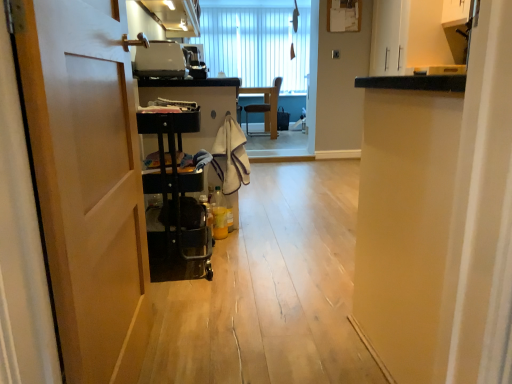
This screenshot has width=512, height=384. Identify the location of white vertical blinds at upper center. (256, 41).

The height and width of the screenshot is (384, 512). What do you see at coordinates (264, 108) in the screenshot?
I see `wooden chair at center` at bounding box center [264, 108].

The width and height of the screenshot is (512, 384). What are the coordinates of `beige textured towel at center` in the screenshot? It's located at (230, 156).

Identify the location of black plastic cart at left. (180, 227).

Between wooden at left and beige textured towel at center, which one has larger size?

wooden at left.

Which of these two, wooden at left or beige textured towel at center, stands shorter?

beige textured towel at center.

How many degrees apart are the facing directions of wooden at left and beige textured towel at center?

Result: wooden at left and beige textured towel at center are facing 89.2 degrees away from each other.

Which is further, (248,174) or (160,59)?

Point (248,174)

From the image's perspective, which one is positioned higher, beige textured towel at center or matte black toaster at upper center?

matte black toaster at upper center appears higher in the image.

Looking at this image, would you consider beige textured towel at center to be distant from matte black toaster at upper center?

beige textured towel at center is actually quite close to matte black toaster at upper center.

Can you confirm if beige textured towel at center is smaller than matte black toaster at upper center?

Indeed, beige textured towel at center has a smaller size compared to matte black toaster at upper center.

Is black plastic cart at left outside of wooden at left?

That's correct, black plastic cart at left is outside of wooden at left.

Between black plastic cart at left and wooden at left, which one has smaller size?

With smaller size is wooden at left.

Find the location of a particular element. The height and width of the screenshot is (384, 512). furniture to the right of wooden at left is located at coordinates (180, 227).

Which is more to the left, black plastic cart at left or wooden at left?

wooden at left.

Which is more distant, (225, 5) or (272, 123)?

Point (225, 5)

From a real-world perspective, who is located higher, white vertical blinds at upper center or wooden chair at center?

From a 3D spatial view, white vertical blinds at upper center is above.

Which of these two, white vertical blinds at upper center or wooden chair at center, is wider?

wooden chair at center is wider.

Is white vertical blinds at upper center looking in the opposite direction of wooden chair at center?

No, wooden chair at center is not at the back of white vertical blinds at upper center.

Which point is more distant from viewer, (216, 166) or (128, 221)?

The point (216, 166) is farther.

Is beige textured towel at center in front of or behind wooden at left in the image?

Visually, beige textured towel at center is located behind wooden at left.

Considering the relative sizes of beige textured towel at center and wooden at left in the image provided, is beige textured towel at center bigger than wooden at left?

No.

Is beige textured towel at center at the left side of wooden at left?

No, beige textured towel at center is not to the left of wooden at left.

Is the position of matte black toaster at upper center less distant than that of black plastic cart at left?

No, matte black toaster at upper center is further to the viewer.

Is matte black toaster at upper center touching black plastic cart at left?

matte black toaster at upper center and black plastic cart at left are clearly separated.

Could you tell me if matte black toaster at upper center is facing black plastic cart at left?

No, matte black toaster at upper center does not turn towards black plastic cart at left.

Is matte black toaster at upper center wider or thinner than black plastic cart at left?

Considering their sizes, matte black toaster at upper center looks slimmer than black plastic cart at left.

From the image's perspective, which one is positioned lower, matte black toaster at upper center or wooden chair at center?

From the image's view, matte black toaster at upper center is below.

From a real-world perspective, is matte black toaster at upper center beneath wooden chair at center?

No.

Is matte black toaster at upper center completely or partially outside of wooden chair at center?

Yes, matte black toaster at upper center is located beyond the bounds of wooden chair at center.

Is matte black toaster at upper center taller than wooden chair at center?

In fact, matte black toaster at upper center may be shorter than wooden chair at center.

In the image, there is a wooden at left. Where is `laundry below it (from a real-world perspective)`? laundry below it (from a real-world perspective) is located at coordinates (230, 156).

The height and width of the screenshot is (384, 512). Identify the location of laundry lying below the matte black toaster at upper center (from the image's perspective). (230, 156).

From the image, which object appears to be farther from beige textured towel at center, white vertical blinds at upper center or matte black toaster at upper center?

white vertical blinds at upper center lies further to beige textured towel at center than the other object.

When comparing their distances from white vertical blinds at upper center, does wooden chair at center or matte white cabinet at upper center seem further?

matte white cabinet at upper center lies further to white vertical blinds at upper center than the other object.

Looking at the image, which one is located further to beige textured towel at center, black plastic cart at left or wooden at left?

wooden at left is further to beige textured towel at center.

Considering their positions, is matte black toaster at upper center positioned closer to white vertical blinds at upper center than wooden chair at center?

wooden chair at center lies closer to white vertical blinds at upper center than the other object.

Looking at the image, which one is located closer to black plastic cart at left, beige textured towel at center or matte black toaster at upper center?

matte black toaster at upper center lies closer to black plastic cart at left than the other object.

From the picture: From the image, which object appears to be farther from white vertical blinds at upper center, matte white cabinet at upper center or wooden at left?

wooden at left lies further to white vertical blinds at upper center than the other object.

Estimate the real-world distances between objects in this image. Which object is further from wooden chair at center, matte white cabinet at upper center or beige textured towel at center?

Based on the image, beige textured towel at center appears to be further to wooden chair at center.

Considering their positions, is matte black toaster at upper center positioned further to beige textured towel at center than black plastic cart at left?

matte black toaster at upper center lies further to beige textured towel at center than the other object.

Locate an element on the screen. furniture located between wooden at left and wooden chair at center in the depth direction is located at coordinates (180, 227).

The width and height of the screenshot is (512, 384). In order to click on furniture between matte white cabinet at upper center and wooden at left from top to bottom in this screenshot , I will do `click(180, 227)`.

Find the location of `appliance between matte white cabinet at upper center and beige textured towel at center from top to bottom`. appliance between matte white cabinet at upper center and beige textured towel at center from top to bottom is located at coordinates (160, 60).

Locate an element on the screen. The height and width of the screenshot is (384, 512). cabinetry between wooden at left and wooden chair at center from front to back is located at coordinates (174, 16).